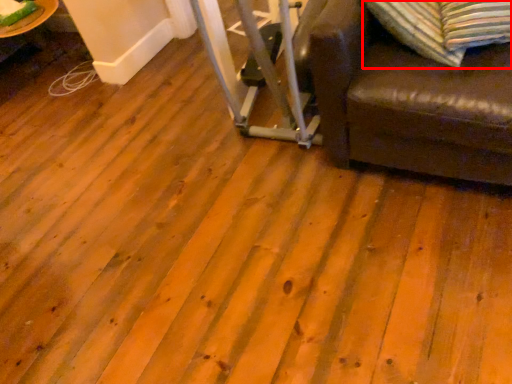
Question: Considering the relative positions of pillow (annotated by the red box) and table in the image provided, where is pillow (annotated by the red box) located with respect to the staircase?

Choices:
 (A) left
 (B) right

Answer: (B)